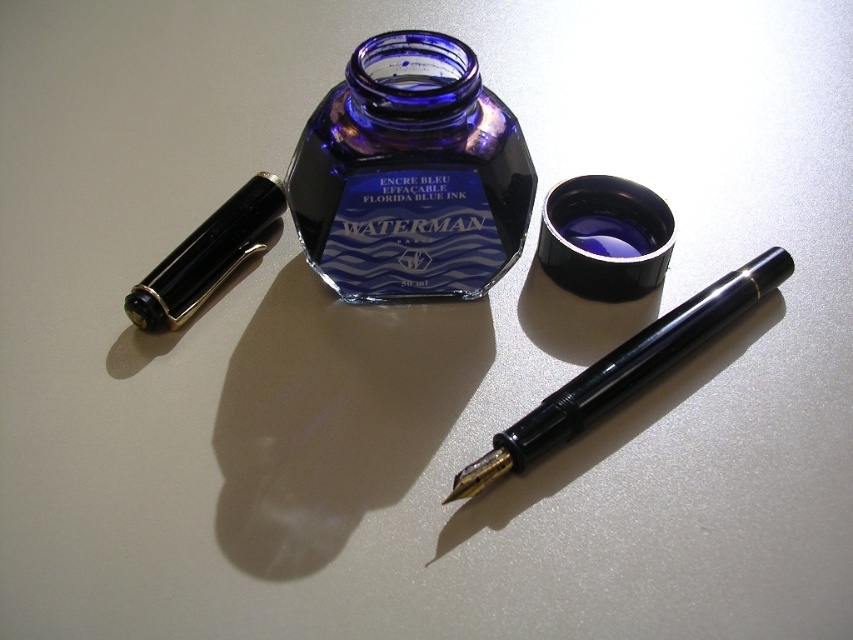
Question: Which point is farther from the camera taking this photo?

Choices:
 (A) click(x=537, y=408)
 (B) click(x=173, y=307)

Answer: (B)

Question: Is the position of cobalt glass bottle at center more distant than that of black glossy pen at center?

Choices:
 (A) yes
 (B) no

Answer: (A)

Question: Which point is closer to the camera?

Choices:
 (A) black glossy pen at left
 (B) cobalt glass bottle at center
 (C) black glossy pen at center
 (D) blue matte ink at center

Answer: (C)

Question: Which point is farther to the camera?

Choices:
 (A) black glossy pen at center
 (B) cobalt glass bottle at center
 (C) blue matte ink at center

Answer: (C)

Question: Can you confirm if cobalt glass bottle at center is wider than blue matte ink at center?

Choices:
 (A) yes
 (B) no

Answer: (A)

Question: Does black glossy pen at center have a lesser width compared to black glossy pen at left?

Choices:
 (A) no
 (B) yes

Answer: (A)